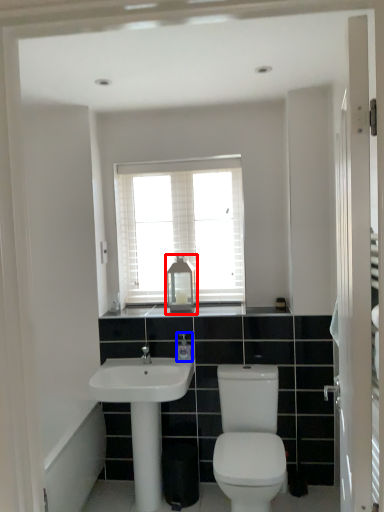
Question: Which of the following is the farthest to the observer, medicine cabinet (highlighted by a red box) or toiletry (highlighted by a blue box)?

Choices:
 (A) medicine cabinet
 (B) toiletry

Answer: (A)